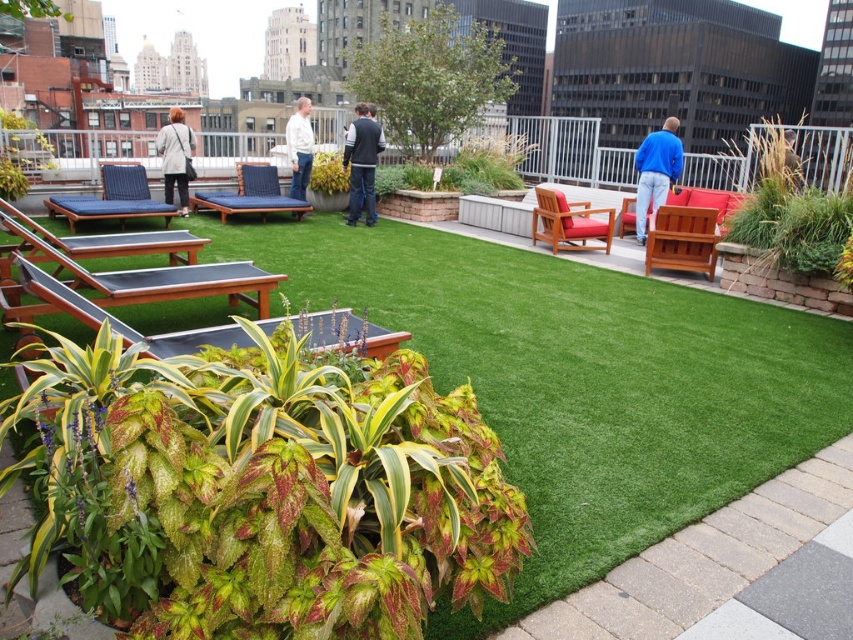
In the scene shown: Can you confirm if dark gray sweater at center is positioned above light gray fabric jacket at upper left?

No.

Which of these two, dark gray sweater at center or light gray fabric jacket at upper left, stands taller?

light gray fabric jacket at upper left

This screenshot has height=640, width=853. I want to click on dark gray sweater at center, so click(x=363, y=163).

Does point (788, 266) come behind point (300, 179)?

No, it is in front of (300, 179).

Is point (735, 225) in front of point (300, 156)?

Yes, point (735, 225) is closer to viewer.

Is point (781, 164) positioned behind point (291, 193)?

That is False.

Identify the location of green grass at center. The height and width of the screenshot is (640, 853). (795, 198).

Can you confirm if blue cotton shirt at center is wider than dark gray sweater at center?

Yes.

Is blue cotton shirt at center positioned before dark gray sweater at center?

Yes, blue cotton shirt at center is closer to the viewer.

Who is more forward, (662, 131) or (352, 216)?

Positioned in front is point (662, 131).

In order to click on blue cotton shirt at center in this screenshot , I will do `click(654, 172)`.